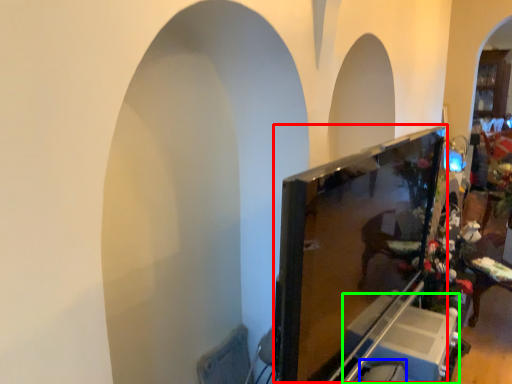
Question: Based on their relative distances, which object is farther from computer monitor (highlighted by a red box)? Choose from swivel chair (highlighted by a blue box) and furniture (highlighted by a green box).

Choices:
 (A) swivel chair
 (B) furniture

Answer: (A)